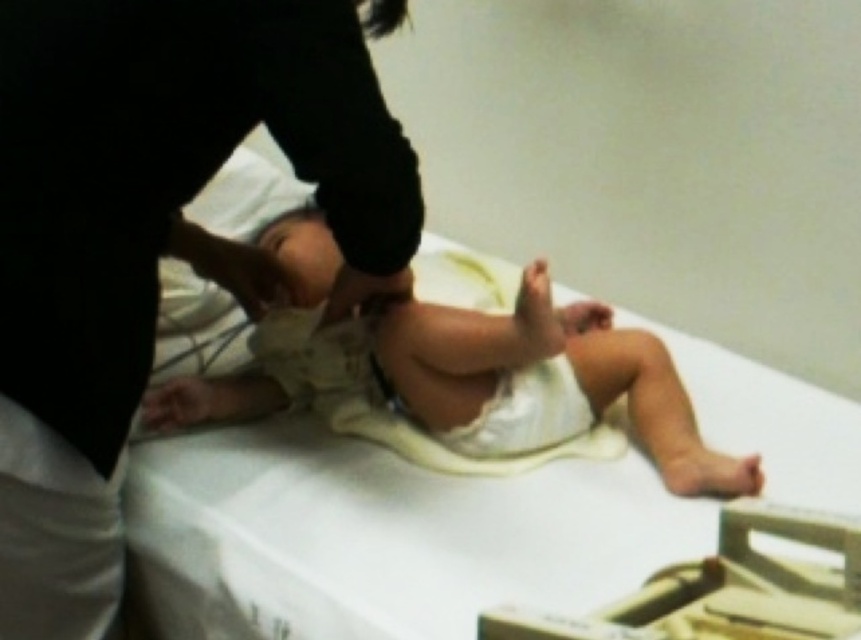
Question: Does black fabric at upper left appear under light beige fabric baby at center?

Choices:
 (A) yes
 (B) no

Answer: (B)

Question: Can you confirm if black fabric at upper left is thinner than light beige fabric baby at center?

Choices:
 (A) no
 (B) yes

Answer: (B)

Question: Which point is farther to the camera?

Choices:
 (A) light beige fabric baby at center
 (B) black fabric at upper left

Answer: (A)

Question: Does black fabric at upper left appear under light beige fabric baby at center?

Choices:
 (A) yes
 (B) no

Answer: (B)